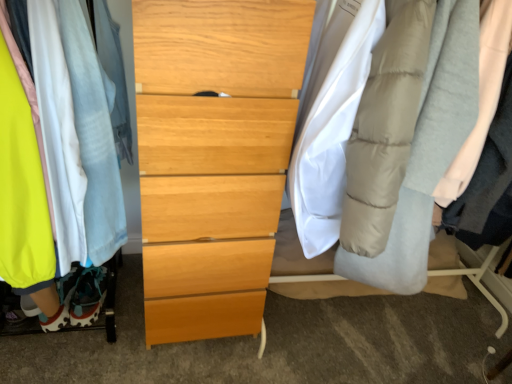
Question: Is matte fabric clothes at left taller or shorter than light blue cotton robe at left, the 2th robe positioned from the right?

Choices:
 (A) tall
 (B) short

Answer: (A)

Question: From the image's perspective, relative to light blue cotton robe at left, the 2th robe positioned from the right, is matte fabric clothes at left above or below?

Choices:
 (A) above
 (B) below

Answer: (B)

Question: Which object is the closest to the light wood chest of drawers at center?

Choices:
 (A) light gray quilted robe at right, the first robe in the right-to-left sequence
 (B) matte blue sneaker at lower left
 (C) matte fabric clothes at left
 (D) light blue cotton robe at left, the 2th robe positioned from the right

Answer: (D)

Question: Estimate the real-world distances between objects in this image. Which object is farther from the matte blue sneaker at lower left?

Choices:
 (A) light wood chest of drawers at center
 (B) light gray quilted robe at right, which appears as the 2th robe when viewed from the left
 (C) matte fabric clothes at left
 (D) light blue cotton robe at left, the 2th robe positioned from the right

Answer: (B)